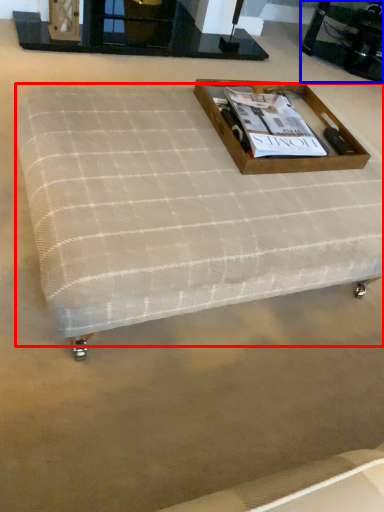
Question: Which of the following is the closest to the observer, mattress (highlighted by a red box) or round table (highlighted by a blue box)?

Choices:
 (A) mattress
 (B) round table

Answer: (A)